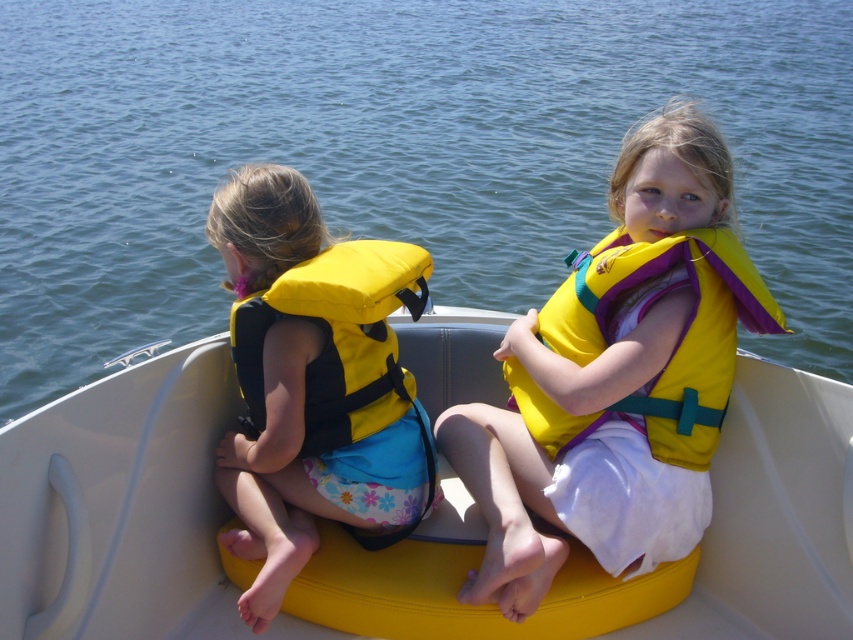
Question: Considering the real-world distances, which object is farthest from the yellow fabric life vest at center?

Choices:
 (A) blue water at center
 (B) yellow fabric life jacket at left
 (C) yellow fabric life vest at left
 (D) yellow plastic boat at center

Answer: (A)

Question: Which of the following is the closest to the observer?

Choices:
 (A) yellow fabric life jacket at center
 (B) yellow fabric life vest at left
 (C) yellow fabric life jacket at left

Answer: (C)

Question: Considering the real-world distances, which object is farthest from the yellow fabric life jacket at center?

Choices:
 (A) yellow fabric life jacket at left
 (B) yellow fabric life vest at center
 (C) yellow fabric life vest at left

Answer: (C)

Question: Does blue water at center appear over yellow fabric life jacket at left?

Choices:
 (A) yes
 (B) no

Answer: (A)

Question: Can you confirm if blue water at center is positioned below yellow fabric life jacket at left?

Choices:
 (A) yes
 (B) no

Answer: (B)

Question: Does yellow fabric life vest at center appear on the right side of yellow fabric life jacket at center?

Choices:
 (A) yes
 (B) no

Answer: (B)